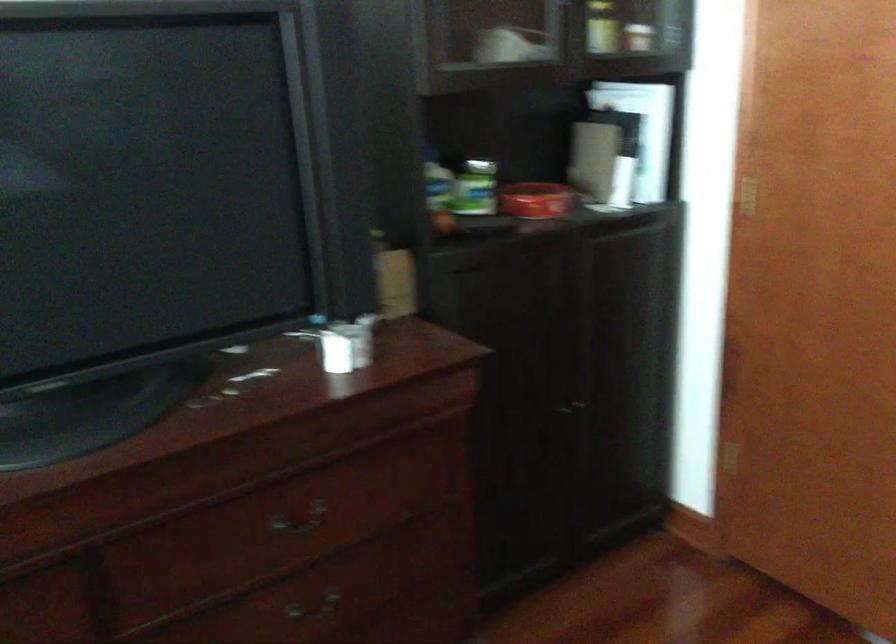
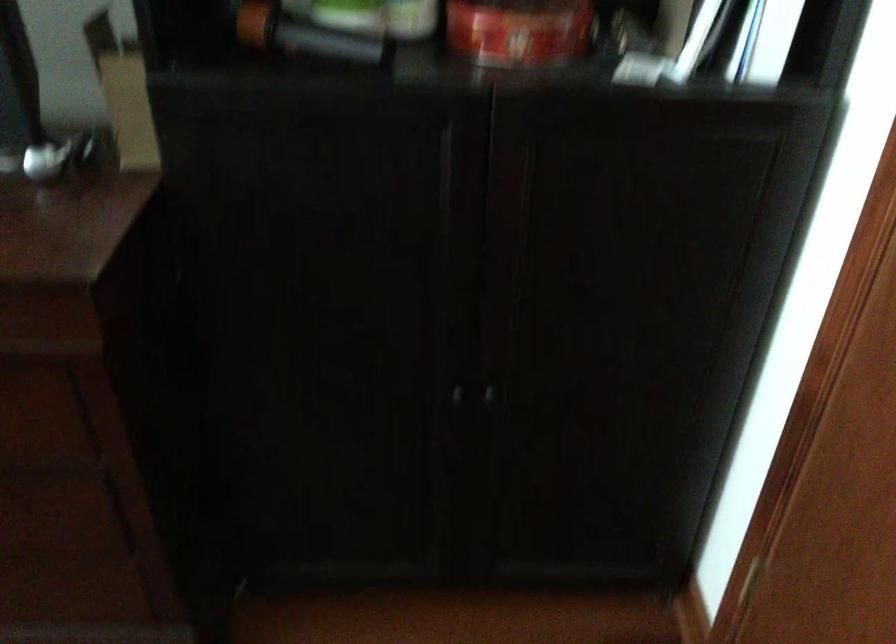
Where in the second image is the point corresponding to point 576,410 from the first image?

(487, 395)